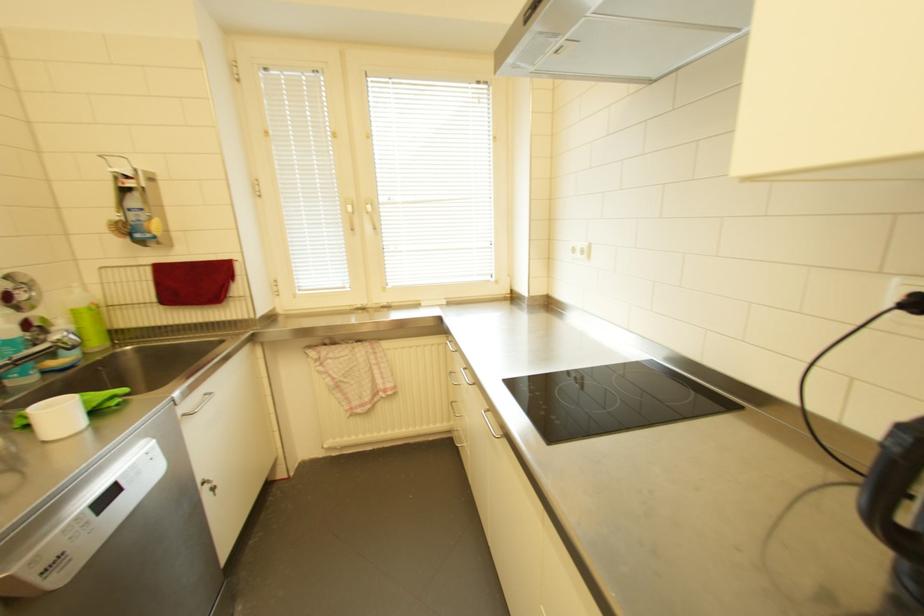
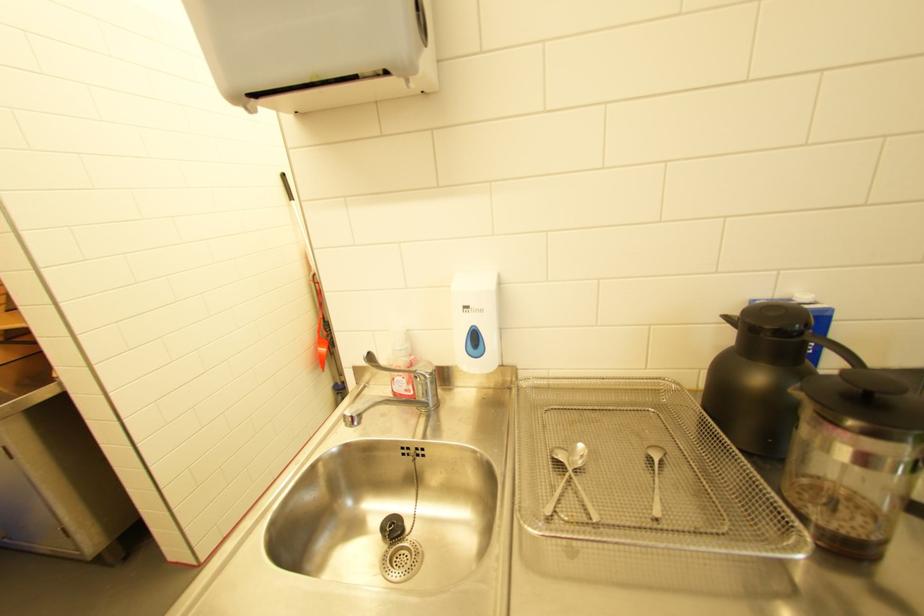
The first image is from the beginning of the video and the second image is from the end. How did the camera likely rotate when shooting the video?

The rotation direction of the camera is left-down.